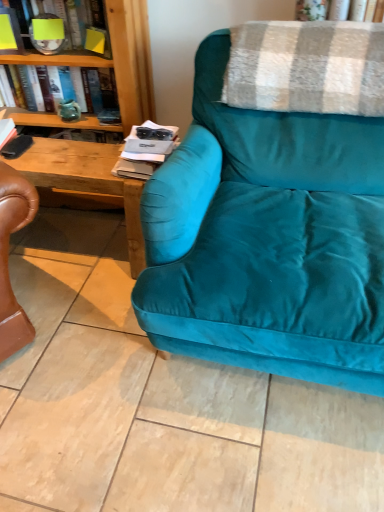
Question: In terms of size, does plaid woolen blanket at upper right appear bigger or smaller than teal velvet couch at center?

Choices:
 (A) big
 (B) small

Answer: (B)

Question: From the image's perspective, is plaid woolen blanket at upper right positioned above or below teal velvet couch at center?

Choices:
 (A) below
 (B) above

Answer: (B)

Question: Which object is positioned farthest from the teal velvet couch at center?

Choices:
 (A) plaid woolen blanket at upper right
 (B) teal glass vase at upper left
 (C) matte black magazine at center
 (D) green glass vase at upper left, which appears as the second book when viewed from the top
 (E) yellow paper at upper left, arranged as the 1th book when viewed from the top

Answer: (B)

Question: Based on their relative distances, which object is farther from the yellow paper at upper left, arranged as the 1th book when viewed from the top?

Choices:
 (A) matte black magazine at center
 (B) plaid woolen blanket at upper right
 (C) teal glass vase at upper left
 (D) teal velvet couch at center
 (E) green glass vase at upper left, acting as the 1th book starting from the bottom

Answer: (D)